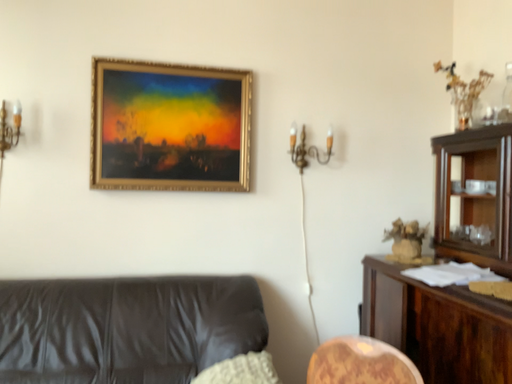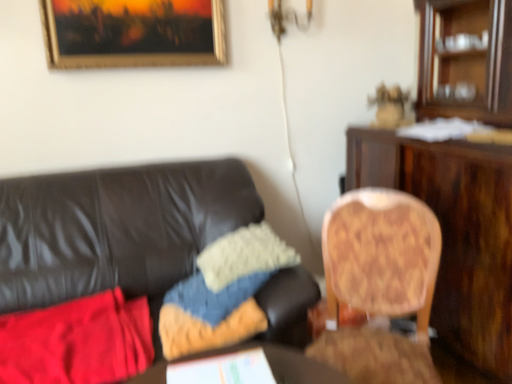
Question: Which way did the camera rotate in the video?

Choices:
 (A) rotated right
 (B) rotated left

Answer: (A)